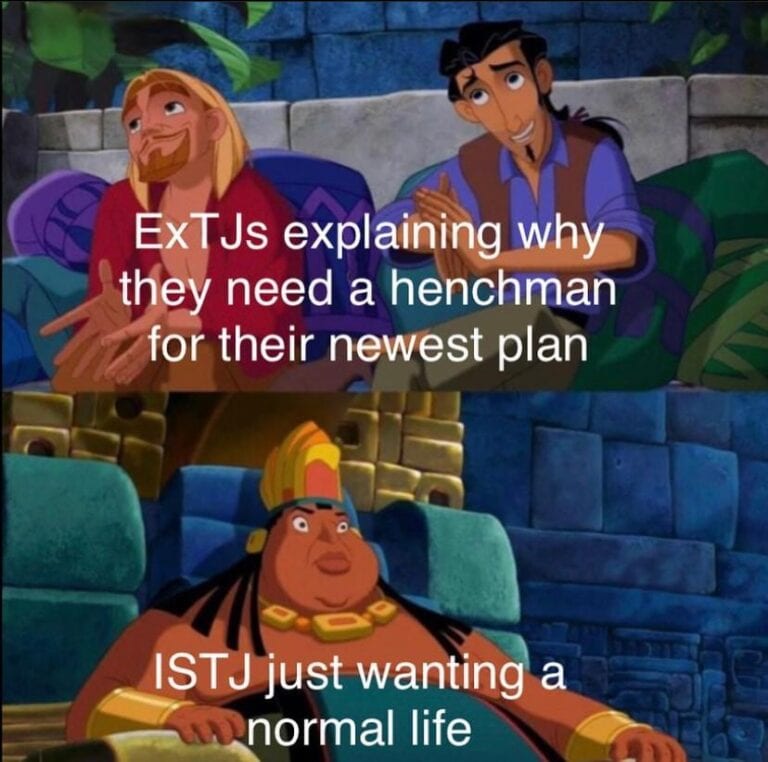
Locate an element on the screen. This screenshot has height=762, width=768. chair is located at coordinates pyautogui.click(x=298, y=191), pyautogui.click(x=669, y=318), pyautogui.click(x=464, y=574).